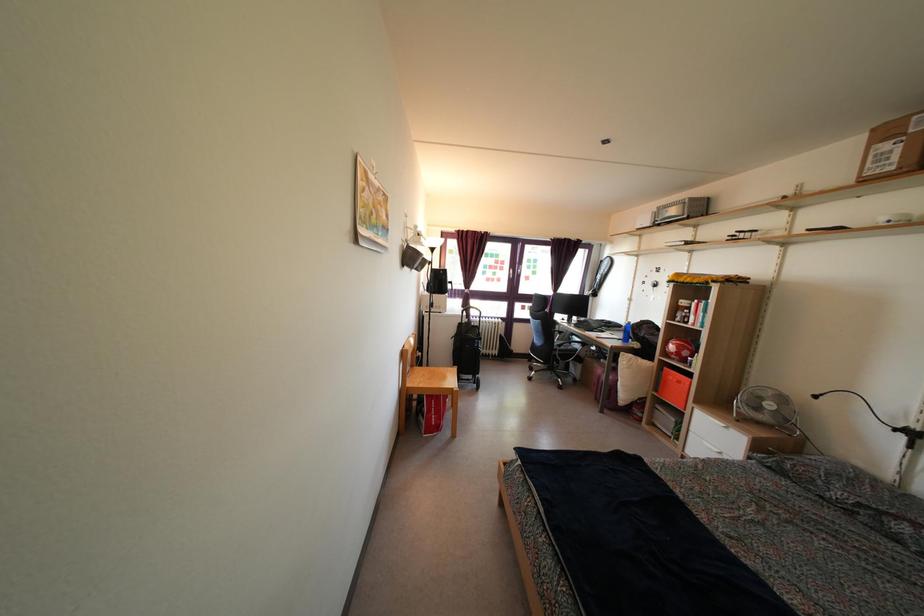
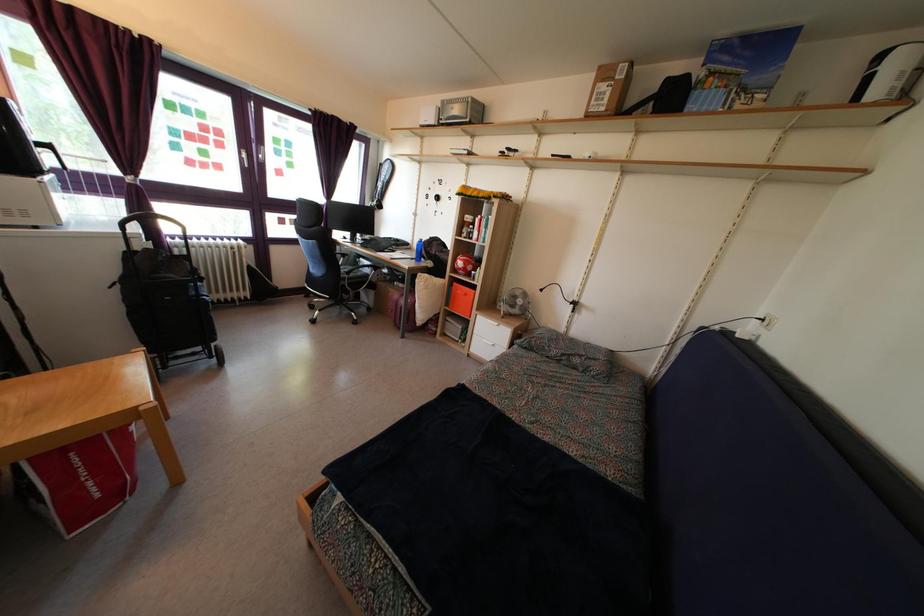
Where in the second image is the point corresponding to (469,315) from the first image?

(146, 225)